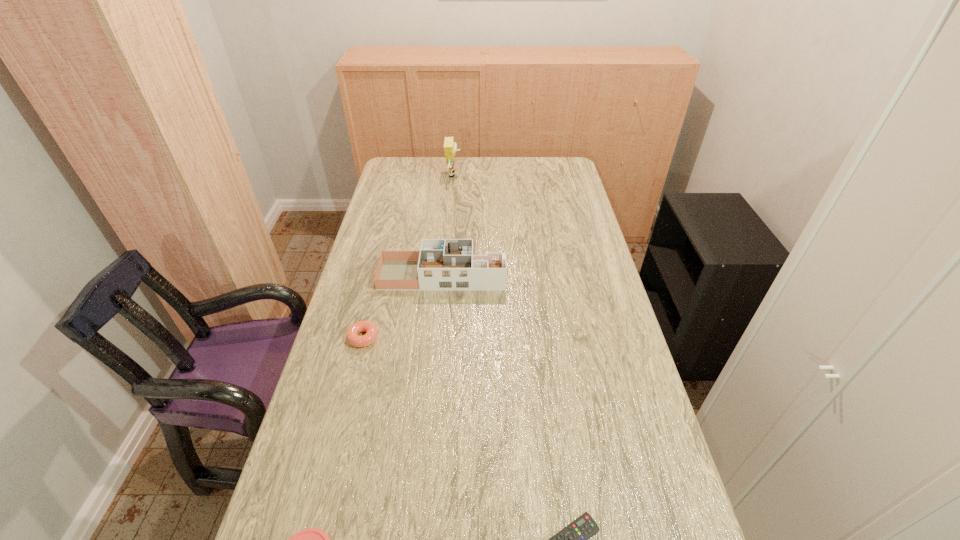
Identify the location of vacant area in the image that satisfies the following two spatial constraints: 1. on the face of the sponge; 2. on the front side of the third farthest object. (439, 338).